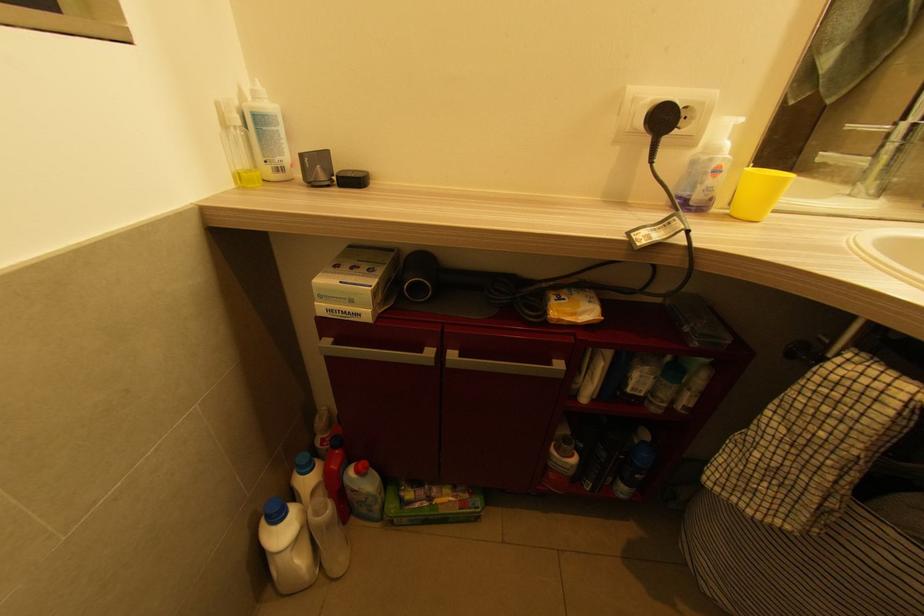
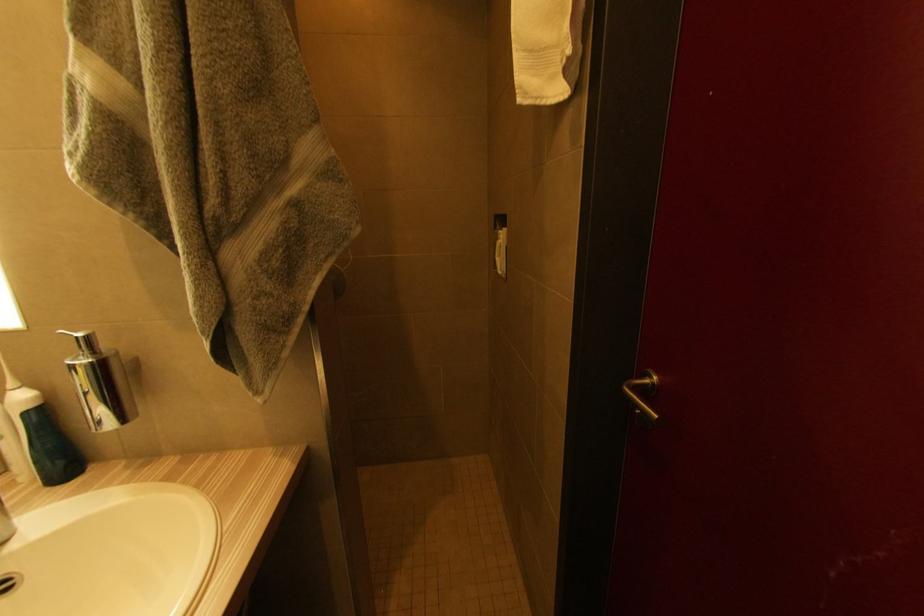
Based on the continuous images, in which direction is the camera rotating?

The camera's rotation is toward right-down.